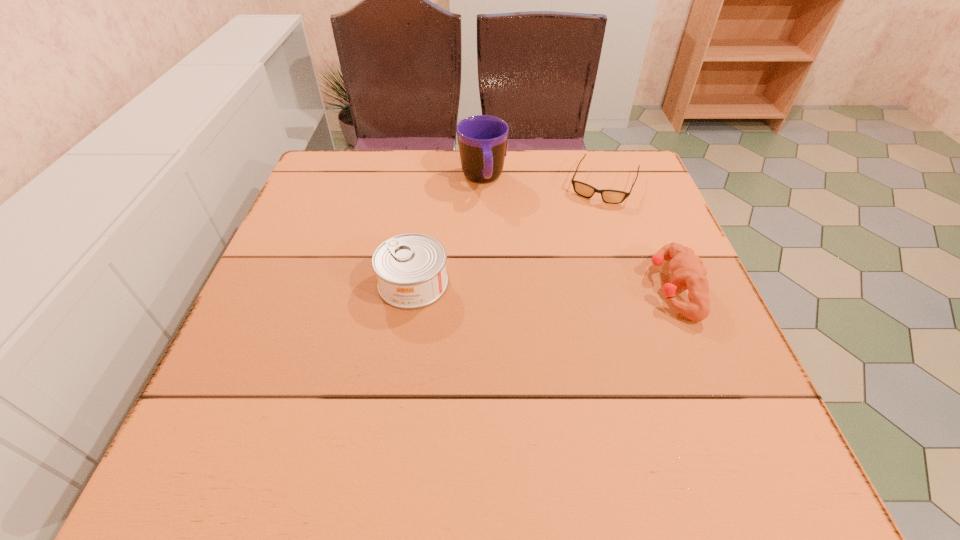
In the image, there is a desktop. Identify the location of vacant area at the far edge. (556, 156).

Where is `vacant region at the near edge of the desktop`? This screenshot has height=540, width=960. vacant region at the near edge of the desktop is located at coordinates (615, 386).

Find the location of a particular element. The width and height of the screenshot is (960, 540). vacant space at the left edge is located at coordinates (342, 220).

In the image, there is a desktop. Identify the location of vacant space at the right edge. (664, 210).

Where is `vacant point at the far left corner`? This screenshot has height=540, width=960. vacant point at the far left corner is located at coordinates (377, 165).

This screenshot has width=960, height=540. Identify the location of vacant point at the near left corner. (295, 407).

What are the coordinates of `blank space at the far right corner of the desktop` in the screenshot? It's located at (631, 201).

At what (x,y) coordinates should I click in order to perform the action: click on free space at the near right corner. Please return your answer as a coordinate pair (x, y). Looking at the image, I should click on (663, 392).

This screenshot has height=540, width=960. What are the coordinates of `free space between the leftmost object and the tallest object` in the screenshot? It's located at (447, 231).

Locate an element on the screen. free area in between the puncher and the tallest object is located at coordinates (578, 234).